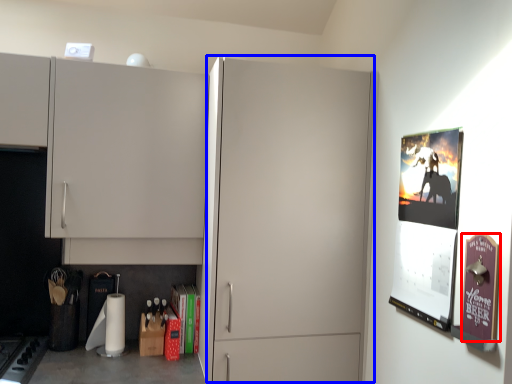
Question: Among these objects, which one is nearest to the camera, poster page (highlighted by a red box) or glass door (highlighted by a blue box)?

Choices:
 (A) poster page
 (B) glass door

Answer: (A)